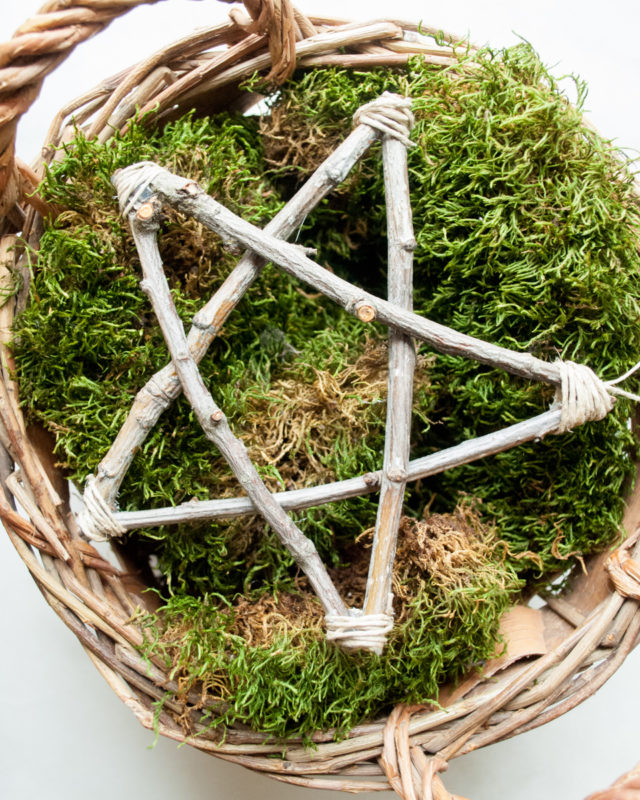
You are a GUI agent. You are given a task and a screenshot of the screen. Output one action in this format:
    pyautogui.click(x=<x>, y=<y>)
    Task: Click on the white top right of basket
    The width and height of the screenshot is (640, 800).
    Given the screenshot: What is the action you would take?
    pyautogui.click(x=593, y=25)